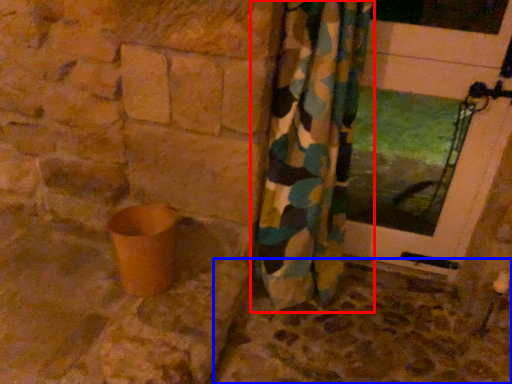
Question: Among these objects, which one is farthest to the camera, curtain (highlighted by a red box) or concrete (highlighted by a blue box)?

Choices:
 (A) curtain
 (B) concrete

Answer: (B)